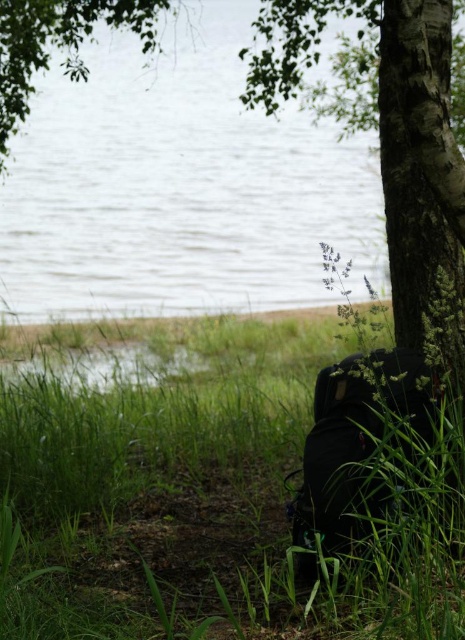
Does green matte grass at lower right appear on the left side of clear water at center?

Incorrect, green matte grass at lower right is not on the left side of clear water at center.

Is green matte grass at lower right taller than clear water at center?

No.

You are a GUI agent. You are given a task and a screenshot of the screen. Output one action in this format:
    pyautogui.click(x=<x>, y=<y>)
    Task: Click on the green matte grass at lower right
    The image size is (465, 640).
    Given the screenshot: What is the action you would take?
    pyautogui.click(x=200, y=492)

Find the location of a particular element. The height and width of the screenshot is (640, 465). green matte grass at lower right is located at coordinates (200, 492).